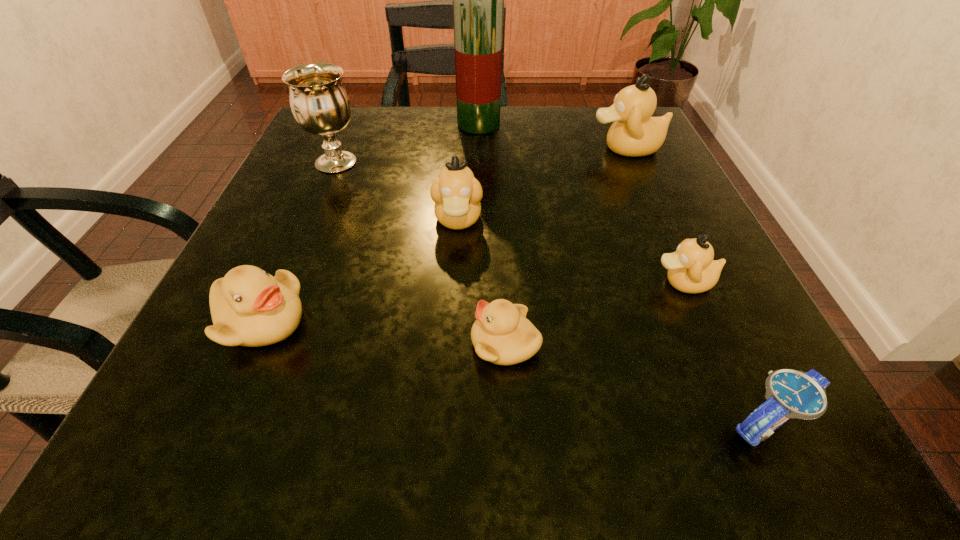
You are a GUI agent. You are given a task and a screenshot of the screen. Output one action in this format:
    pyautogui.click(x=<x>, y=<y>)
    Task: Click on the vacant region located on the beak of the left yellow duckling
    Image resolution: width=960 pixels, height=540 pixels.
    Given the screenshot: What is the action you would take?
    pyautogui.click(x=556, y=321)

You are a GUI agent. You are given a task and a screenshot of the screen. Output one action in this format:
    pyautogui.click(x=<x>, y=<y>)
    Task: Click on the free space located 0.240m on the face of the smallest tan duckling
    The height and width of the screenshot is (540, 960).
    Given the screenshot: What is the action you would take?
    pyautogui.click(x=490, y=282)

The height and width of the screenshot is (540, 960). What are the coordinates of `vacant space situated 0.300m on the face of the smallest tan duckling` in the screenshot? It's located at (449, 282).

Identify the location of vacant space situated on the face of the smallest tan duckling. (381, 282).

Locate an element on the screen. This screenshot has width=960, height=540. vacant space located on the beak of the right yellow duckling is located at coordinates (324, 343).

Identify the location of vacant space located on the beak of the right yellow duckling. (432, 343).

The width and height of the screenshot is (960, 540). Find the location of `free location located 0.080m on the beak of the right yellow duckling`. free location located 0.080m on the beak of the right yellow duckling is located at coordinates (409, 343).

Where is `free space located 0.390m on the left of the watch`? The height and width of the screenshot is (540, 960). free space located 0.390m on the left of the watch is located at coordinates (372, 423).

At what (x,y) coordinates should I click in order to perform the action: click on liquor present at the far edge. Please return your answer as a coordinate pair (x, y). This screenshot has height=540, width=960. Looking at the image, I should click on (478, 0).

Locate an element on the screen. This screenshot has width=960, height=540. chalice that is positioned at the far edge is located at coordinates (320, 104).